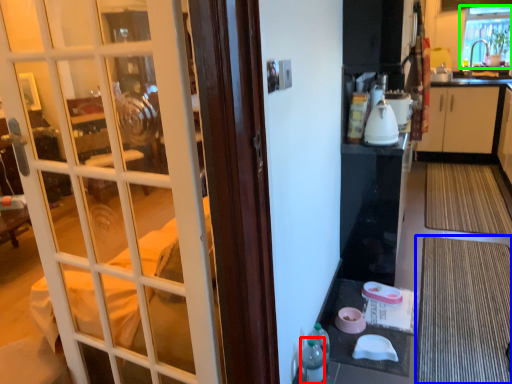
Question: Estimate the real-world distances between objects in this image. Which object is farther from bottle (highlighted by a red box), doormat (highlighted by a blue box) or window (highlighted by a green box)?

Choices:
 (A) doormat
 (B) window

Answer: (B)